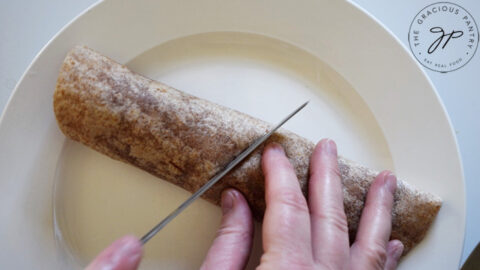
Identify the location of white plate. (342, 123).